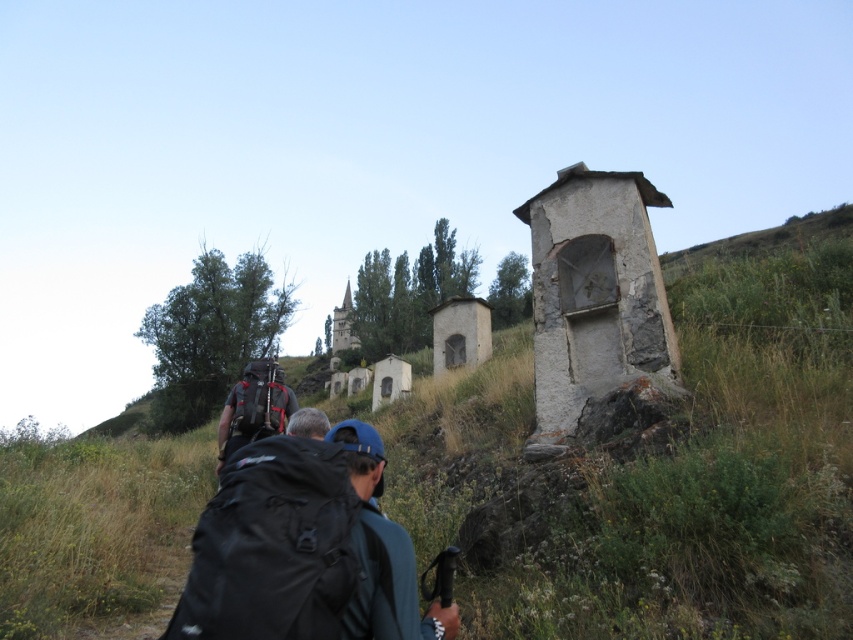
Question: Among these points, which one is farthest from the camera?

Choices:
 (A) (611, 204)
 (B) (341, 308)

Answer: (B)

Question: In this image, where is white stone chapel at center located relative to smooth stone chapel at center?

Choices:
 (A) above
 (B) below

Answer: (B)

Question: Can you confirm if white stone chapel at center is smaller than smooth stone chapel at center?

Choices:
 (A) yes
 (B) no

Answer: (A)

Question: Is the position of white stone chapel at center less distant than that of smooth stone chapel at center?

Choices:
 (A) no
 (B) yes

Answer: (B)